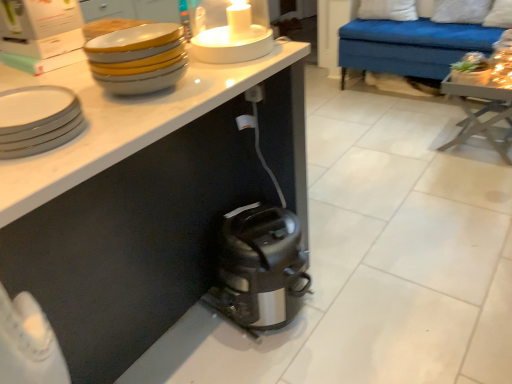
You are a GUI agent. You are given a task and a screenshot of the screen. Output one action in this format:
    pyautogui.click(x=<x>, y=<y>)
    Task: Click on the vacant space positioned to the left of satin silver toaster at lower center
    The height and width of the screenshot is (384, 512).
    Given the screenshot: What is the action you would take?
    click(x=195, y=329)